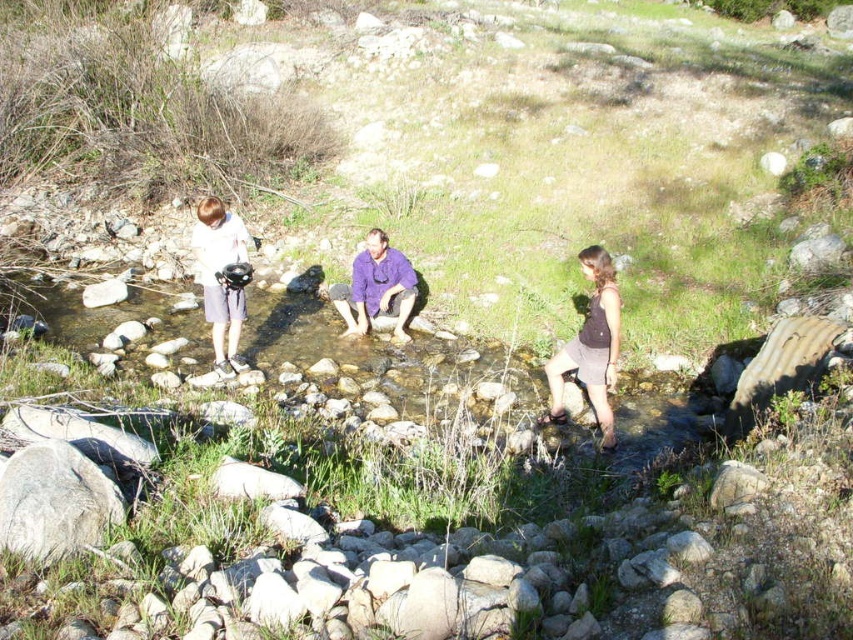
What do you see at coordinates (590, 346) in the screenshot? I see `dark gray fabric skirt at center` at bounding box center [590, 346].

Does point (560, 406) lie in front of point (236, 253)?

Yes, it is in front of point (236, 253).

Locate an element on the screen. dark gray fabric skirt at center is located at coordinates tap(590, 346).

Does dark gray fabric skirt at center have a greater height compared to purple cotton shirt at center?

Correct, dark gray fabric skirt at center is much taller as purple cotton shirt at center.

Is point (581, 378) less distant than point (396, 272)?

Yes, it is.

Identify the location of dark gray fabric skirt at center. The width and height of the screenshot is (853, 640). (590, 346).

Which of these two, matte black helmet at left or purple cotton shirt at center, stands taller?

matte black helmet at left is taller.

Is matte black helmet at left further to camera compared to purple cotton shirt at center?

No.

Does point (207, 292) come closer to viewer compared to point (415, 278)?

Yes, it is.

Where is `matte black helmet at left`? The width and height of the screenshot is (853, 640). matte black helmet at left is located at coordinates (219, 278).